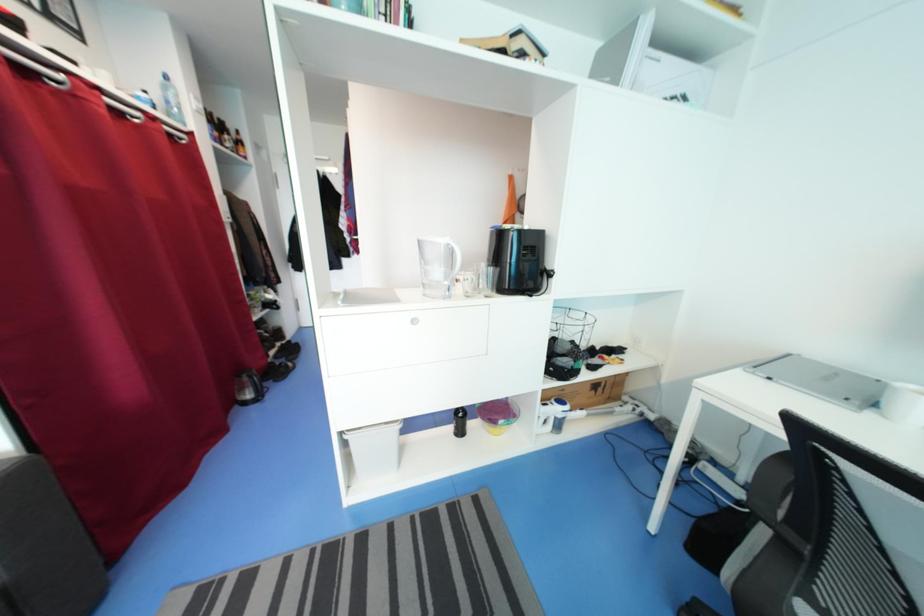
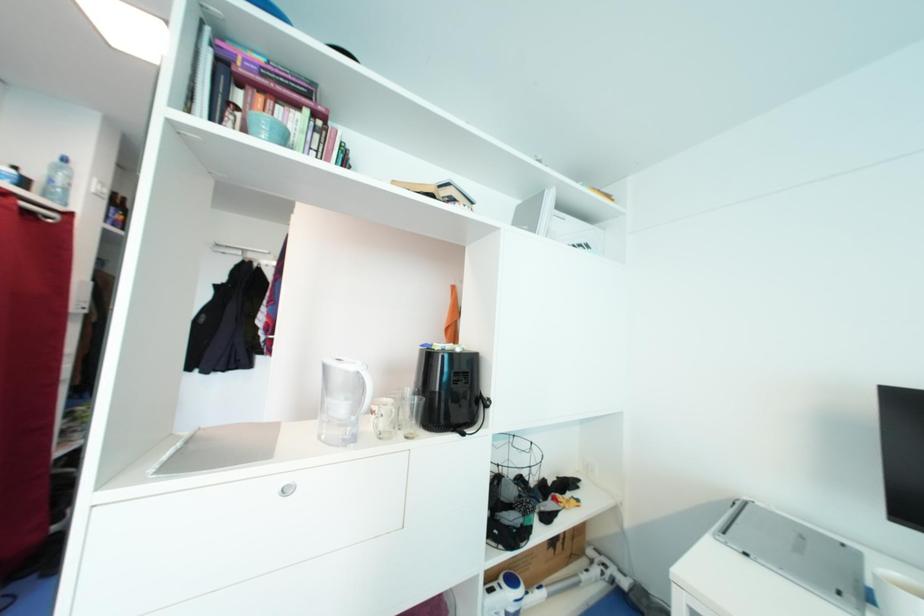
Question: How did the camera likely rotate?

Choices:
 (A) Left
 (B) Right
 (C) Up
 (D) Down

Answer: (C)